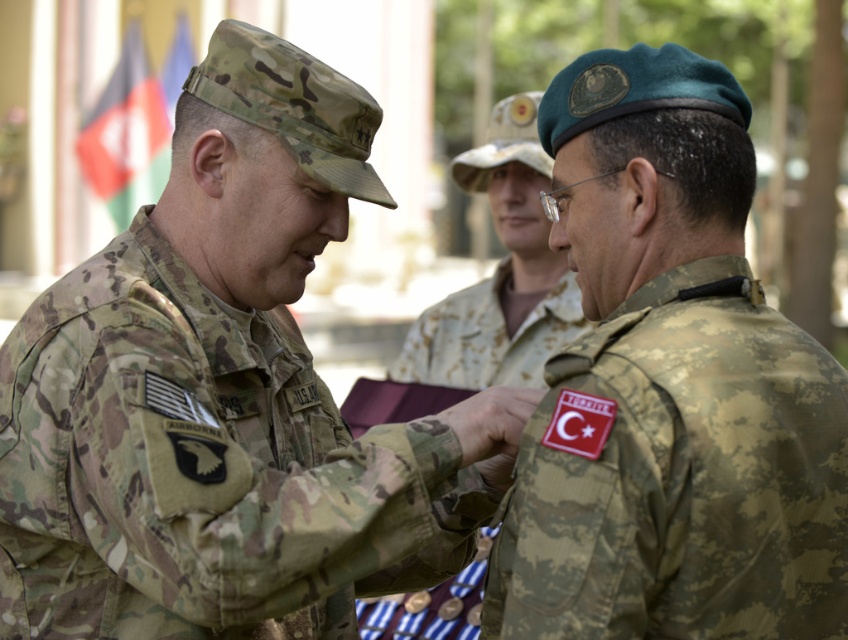
Question: Among these points, which one is nearest to the camera?

Choices:
 (A) (40, 616)
 (B) (530, 483)

Answer: (B)

Question: Can you confirm if camo uniform at center is bigger than camouflage fabric beret at upper right?

Choices:
 (A) yes
 (B) no

Answer: (A)

Question: Can you confirm if camo uniform at center is bigger than camouflage fabric beret at upper right?

Choices:
 (A) no
 (B) yes

Answer: (B)

Question: Is camo uniform at center bigger than camouflage fabric beret at upper right?

Choices:
 (A) yes
 (B) no

Answer: (A)

Question: Among these objects, which one is nearest to the camera?

Choices:
 (A) camouflage fabric beret at upper right
 (B) camo uniform at center

Answer: (A)